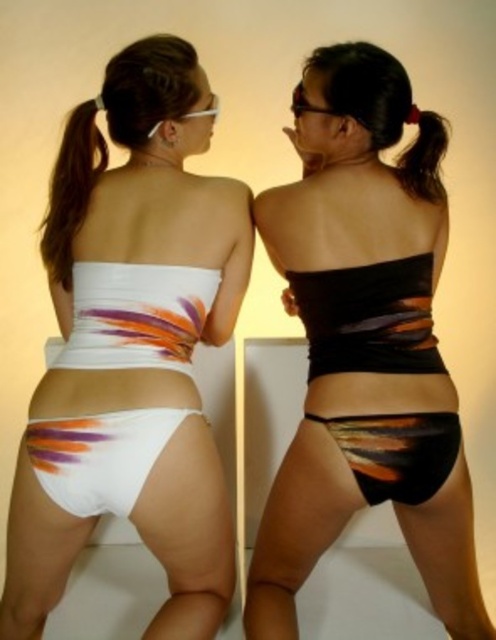
What do you see at coordinates (147, 184) in the screenshot? I see `white matte bikini bottom at center` at bounding box center [147, 184].

Who is taller, white matte bikini bottom at center or shiny orange fabric bikini bottom at center?

white matte bikini bottom at center is taller.

This screenshot has height=640, width=496. I want to click on white matte bikini bottom at center, so click(147, 184).

Is white matte bikini bottom at lower left smaller than shiny orange fabric bikini bottom at center?

Actually, white matte bikini bottom at lower left might be larger than shiny orange fabric bikini bottom at center.

Is point (82, 435) positioned after point (430, 449)?

No, (82, 435) is in front of (430, 449).

Find the location of a particular element. The width and height of the screenshot is (496, 640). white matte bikini bottom at lower left is located at coordinates (100, 456).

Is white matte bikini bottom at center bigger than white matte bikini bottom at lower left?

Yes.

Can you confirm if white matte bikini bottom at center is positioned to the right of white matte bikini bottom at lower left?

Yes, white matte bikini bottom at center is to the right of white matte bikini bottom at lower left.

Who is more forward, (x=221, y=285) or (x=118, y=476)?

Positioned in front is point (x=118, y=476).

The height and width of the screenshot is (640, 496). I want to click on white matte bikini bottom at center, so click(x=147, y=184).